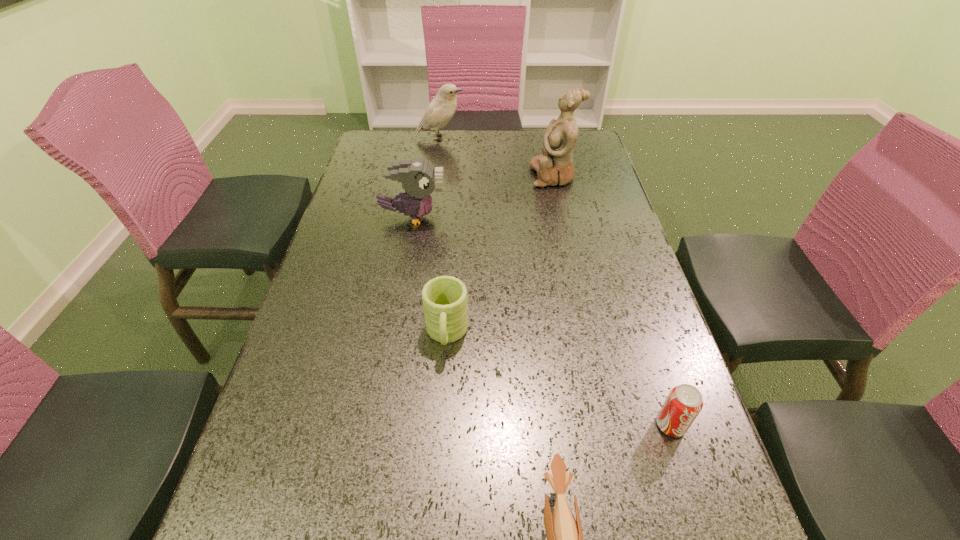
Find the location of a particular element. This screenshot has width=960, height=540. the second object from right to left is located at coordinates (555, 167).

This screenshot has height=540, width=960. I want to click on figurine, so click(x=555, y=167).

Identify the location of the farthest object. (442, 108).

I want to click on the third farthest object, so click(x=419, y=178).

Locate an element on the screen. The height and width of the screenshot is (540, 960). mug is located at coordinates (444, 298).

Where is `soda can`? The width and height of the screenshot is (960, 540). soda can is located at coordinates (x=684, y=402).

The height and width of the screenshot is (540, 960). I want to click on the second nearest object, so click(x=684, y=402).

At what (x,y) coordinates should I click in order to perform the action: click on free location located on the front-facing side of the tallest object. Please return your answer as a coordinate pair (x, y). Looking at the image, I should click on (471, 176).

Identify the location of free spot located 0.180m on the front-facing side of the tallest object. (474, 176).

Identify the location of free space located on the front-facing side of the tallest object. The image size is (960, 540). (418, 176).